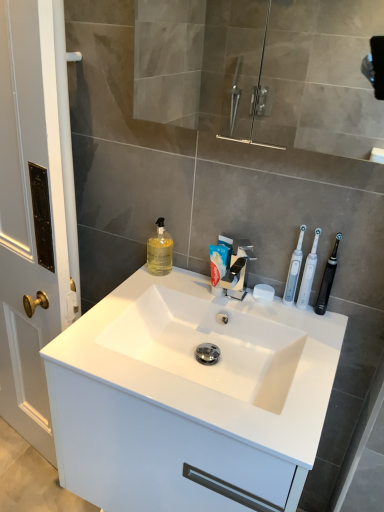
Find the location of a particular element. vacant area that lies between black plastic toothbrush at right, which is the third toothbrush from left to right, and polished chrome faucet at center is located at coordinates (269, 312).